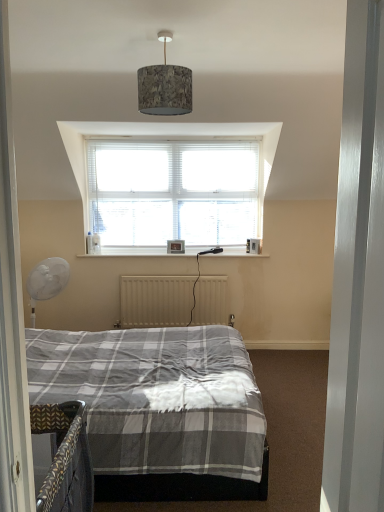
Question: Is metallic silver door at right outside wooden picture frame at center?

Choices:
 (A) no
 (B) yes

Answer: (B)

Question: Does metallic silver door at right come behind wooden picture frame at center?

Choices:
 (A) yes
 (B) no

Answer: (B)

Question: Is metallic silver door at right taller than wooden picture frame at center?

Choices:
 (A) yes
 (B) no

Answer: (A)

Question: Considering the relative sizes of metallic silver door at right and wooden picture frame at center in the image provided, is metallic silver door at right wider than wooden picture frame at center?

Choices:
 (A) yes
 (B) no

Answer: (A)

Question: Can you confirm if metallic silver door at right is bigger than wooden picture frame at center?

Choices:
 (A) no
 (B) yes

Answer: (B)

Question: Is metallic silver door at right positioned before wooden picture frame at center?

Choices:
 (A) no
 (B) yes

Answer: (B)

Question: Is wooden picture frame at center taller than textured fabric lampshade at upper center?

Choices:
 (A) yes
 (B) no

Answer: (B)

Question: Does wooden picture frame at center have a greater width compared to textured fabric lampshade at upper center?

Choices:
 (A) no
 (B) yes

Answer: (A)

Question: From a real-world perspective, does wooden picture frame at center stand above textured fabric lampshade at upper center?

Choices:
 (A) no
 (B) yes

Answer: (A)

Question: Is textured fabric lampshade at upper center at the back of wooden picture frame at center?

Choices:
 (A) yes
 (B) no

Answer: (B)

Question: Is wooden picture frame at center further to the viewer compared to textured fabric lampshade at upper center?

Choices:
 (A) yes
 (B) no

Answer: (A)

Question: Does wooden picture frame at center come in front of textured fabric lampshade at upper center?

Choices:
 (A) yes
 (B) no

Answer: (B)

Question: Can you confirm if textured fabric lampshade at upper center is smaller than wooden picture frame at center?

Choices:
 (A) no
 (B) yes

Answer: (A)